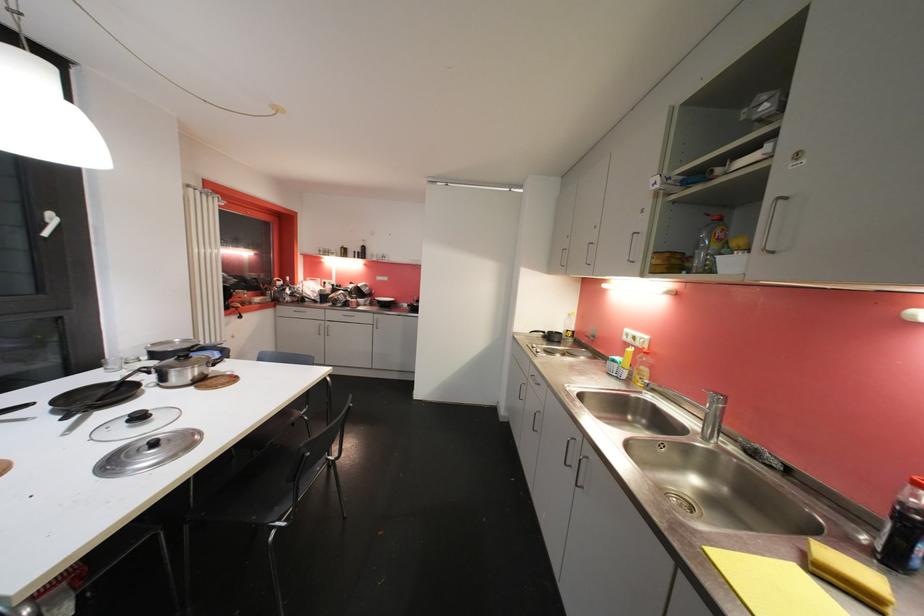
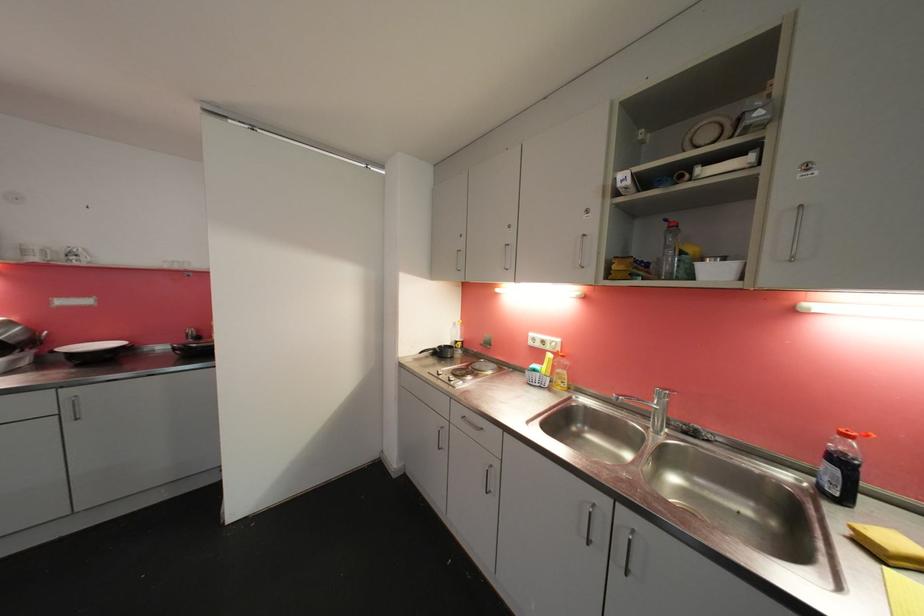
Find the pixel in the second image that matches (x=636, y=352) in the first image.

(554, 358)